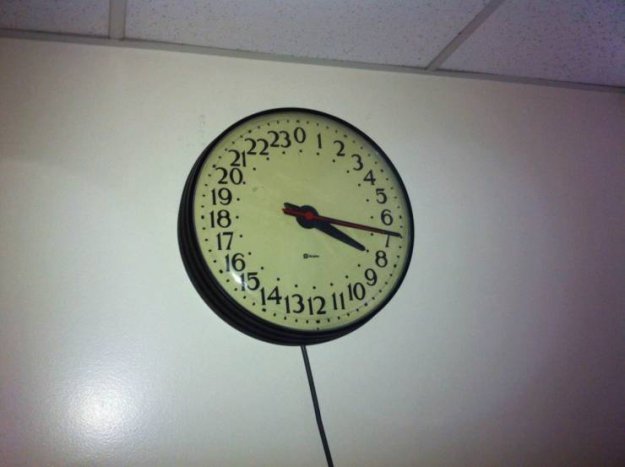
I want to click on wall, so click(449, 430).